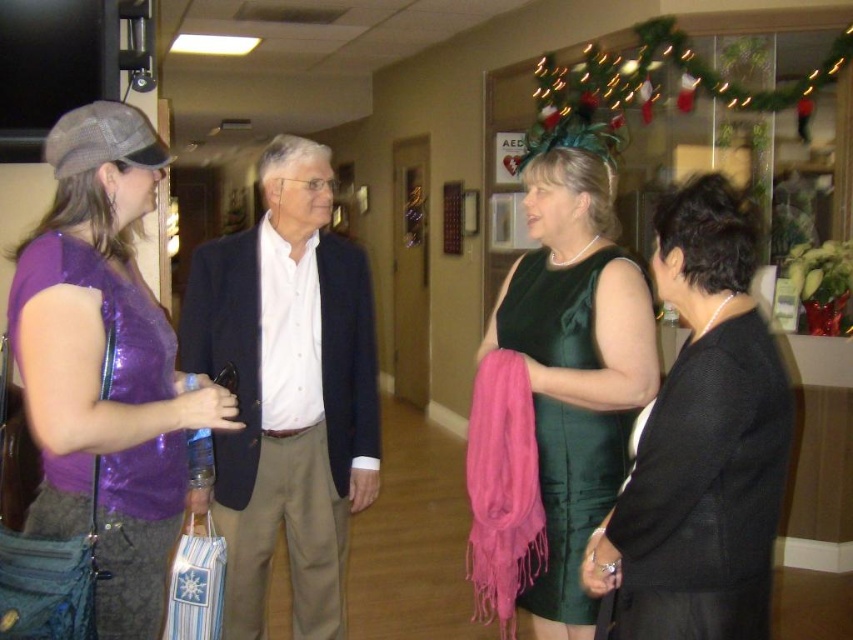
Question: Where is matte black dress at right located in relation to green velvet dress at center in the image?

Choices:
 (A) below
 (B) above

Answer: (B)

Question: Is the position of white shirt at center more distant than that of green velvet dress at center?

Choices:
 (A) yes
 (B) no

Answer: (A)

Question: Which of the following is the farthest from the observer?

Choices:
 (A) (21, 250)
 (B) (351, 508)

Answer: (B)

Question: Estimate the real-world distances between objects in this image. Which object is farther from the white shirt at center?

Choices:
 (A) shiny purple top at left
 (B) green velvet dress at center
 (C) matte black dress at right

Answer: (C)

Question: Which point is closer to the camera?

Choices:
 (A) (525, 284)
 (B) (283, 332)

Answer: (A)

Question: Is white shirt at center bigger than green velvet dress at center?

Choices:
 (A) yes
 (B) no

Answer: (A)